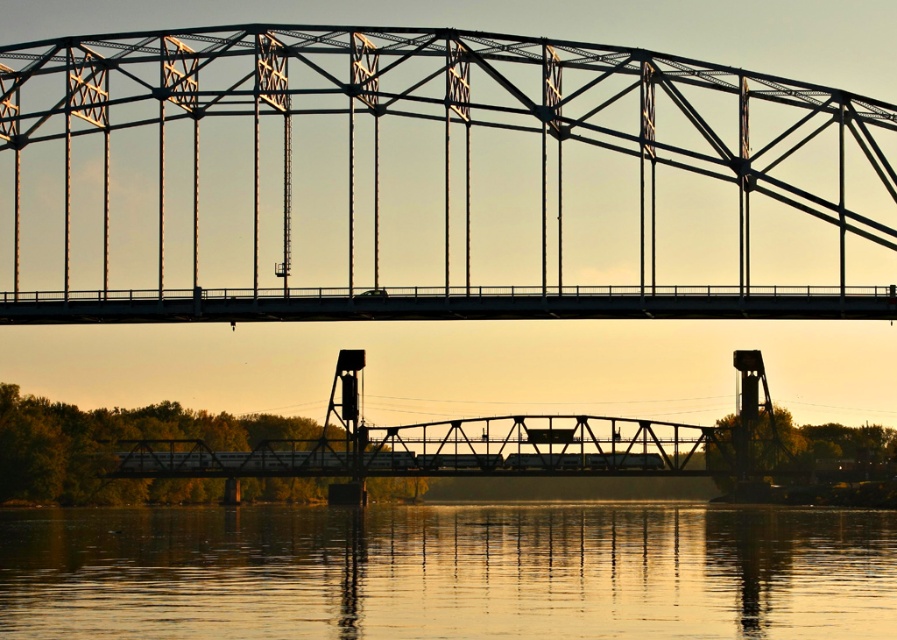
In the scene shown: You are a boat captain trying to navigate through the scene. You see the black steel bridge at center and the smooth gold water at lower center. Which object is located to the left of the other?

The black steel bridge at center is positioned on the left side of smooth gold water at lower center.

You are standing at the camera position and want to cross the black steel bridge at center. The bridge is 161.97 meters away. If your walking speed is 1.5 meters per second, how many seconds will it take you to reach the bridge?

The black steel bridge at center is 161.97 meters from the camera. At a walking speed of 1.5 meters per second, it would take approximately 107.98 seconds to reach the bridge.

You are standing at the point marked by coordinates point (430, 180). Which bridge are you currently on?

The point (430, 180) corresponds to the black steel bridge at center, so you are currently on the black steel bridge at center.